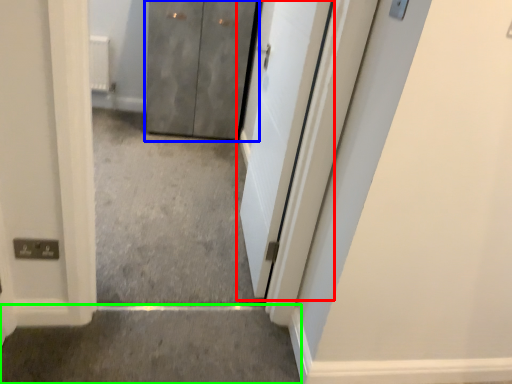
Question: Which object is positioned closest to door (highlighted by a red box)? Select from door (highlighted by a blue box) and concrete (highlighted by a green box).

Choices:
 (A) door
 (B) concrete

Answer: (B)